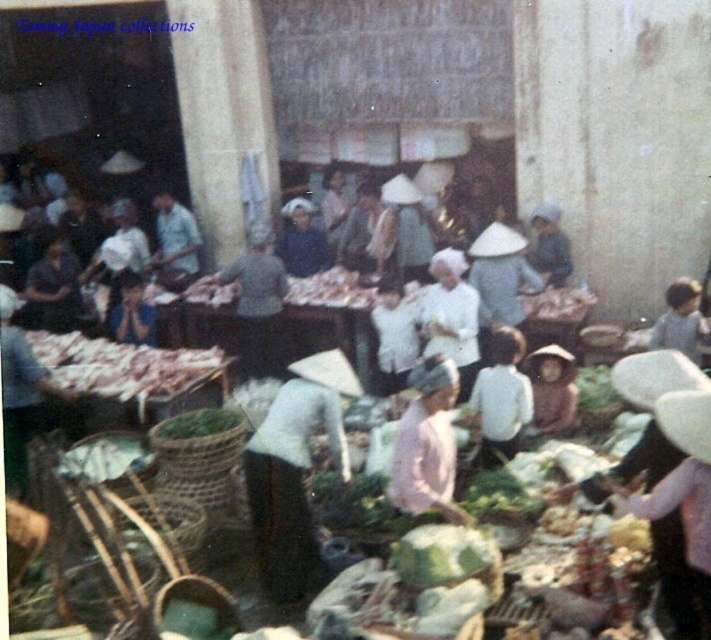
Does white fabric hat at center have a lesser height compared to light pink fabric hat at center?

No.

I want to click on white fabric hat at center, so click(x=294, y=470).

This screenshot has height=640, width=711. In order to click on white fabric hat at center in this screenshot , I will do `click(294, 470)`.

Can you confirm if brown woven basket at lower left is wider than white matte child at center?

Indeed, brown woven basket at lower left has a greater width compared to white matte child at center.

Who is more distant from viewer, (149, 604) or (508, 438)?

Positioned behind is point (508, 438).

Does point (146, 592) come closer to viewer compared to point (513, 410)?

Yes.

This screenshot has height=640, width=711. What are the coordinates of `brown woven basket at lower left` in the screenshot? It's located at (122, 547).

Can you confirm if white fabric hat at center is shorter than green woven basket at lower center?

No, white fabric hat at center is not shorter than green woven basket at lower center.

Identify the location of white fabric hat at center. This screenshot has width=711, height=640. (294, 470).